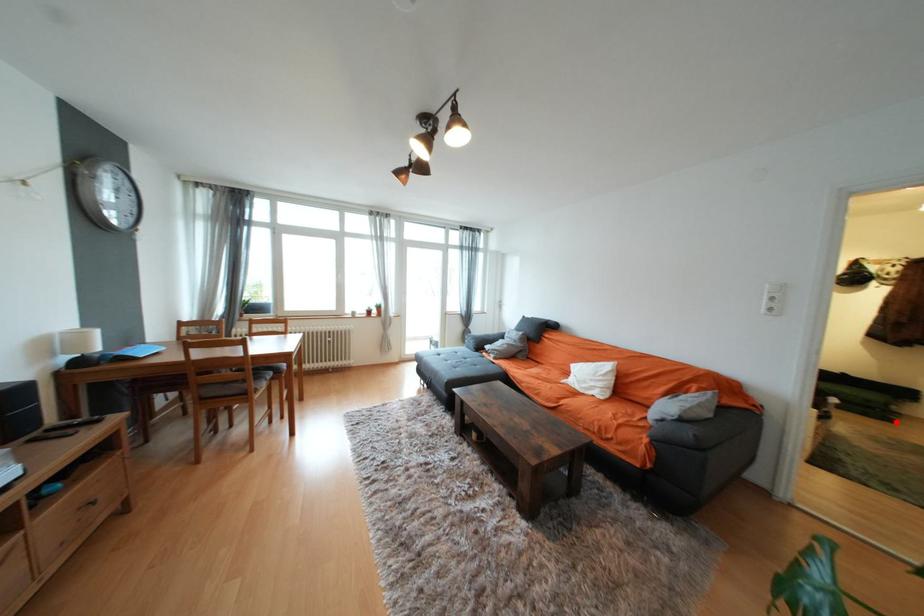
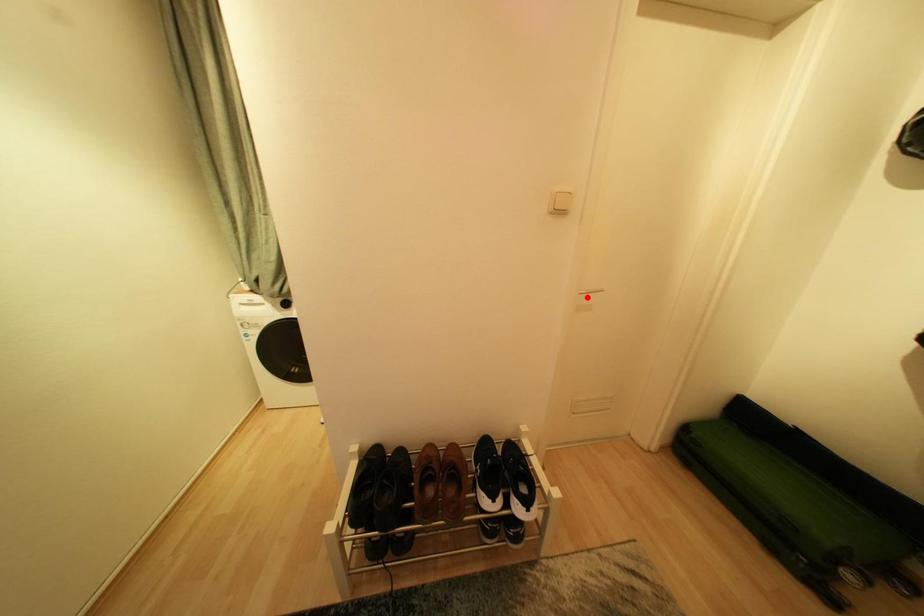
I am providing you with two images of the same scene from different viewpoints. A red point is marked on the first image and another point is marked on the second image. Is the red point in image1 aligned with the point shown in image2?

No